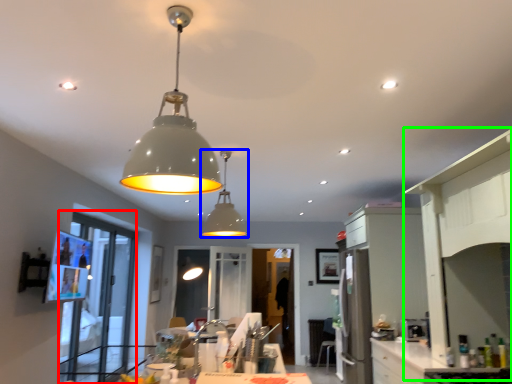
Question: Which object is the farthest from glass door (highlighted by a red box)? Choose among these: lamp (highlighted by a blue box) or side (highlighted by a green box).

Choices:
 (A) lamp
 (B) side

Answer: (B)